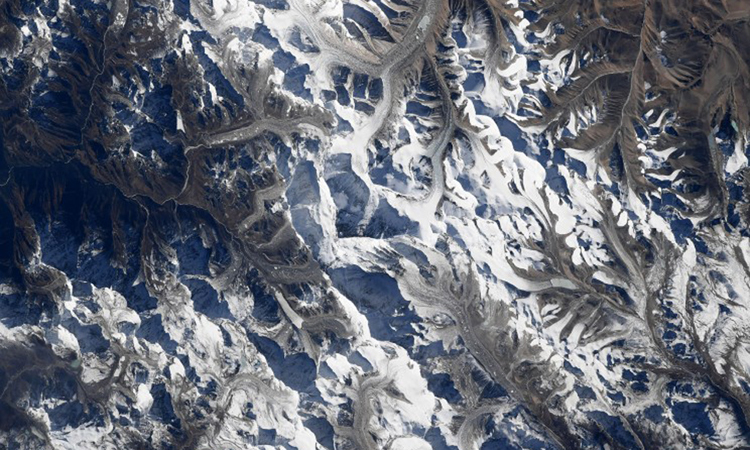
Locate an element on the screen. The width and height of the screenshot is (750, 450). corner is located at coordinates (700, 43).